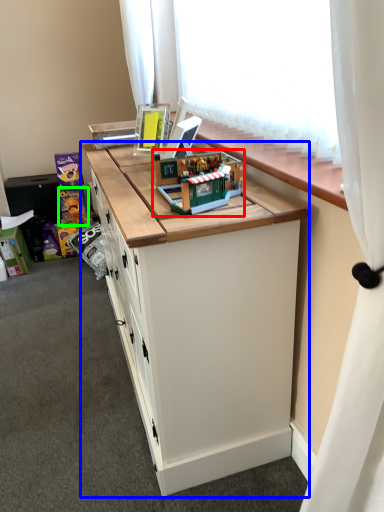
Question: Estimate the real-world distances between objects in this image. Which object is farther from toy (highlighted by a red box), cabinetry (highlighted by a blue box) or toy (highlighted by a green box)?

Choices:
 (A) cabinetry
 (B) toy

Answer: (B)